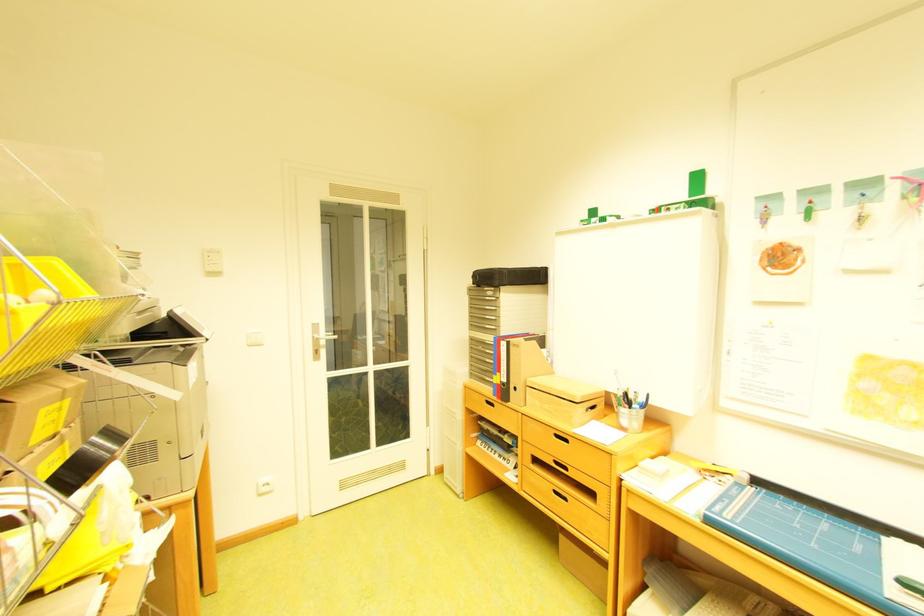
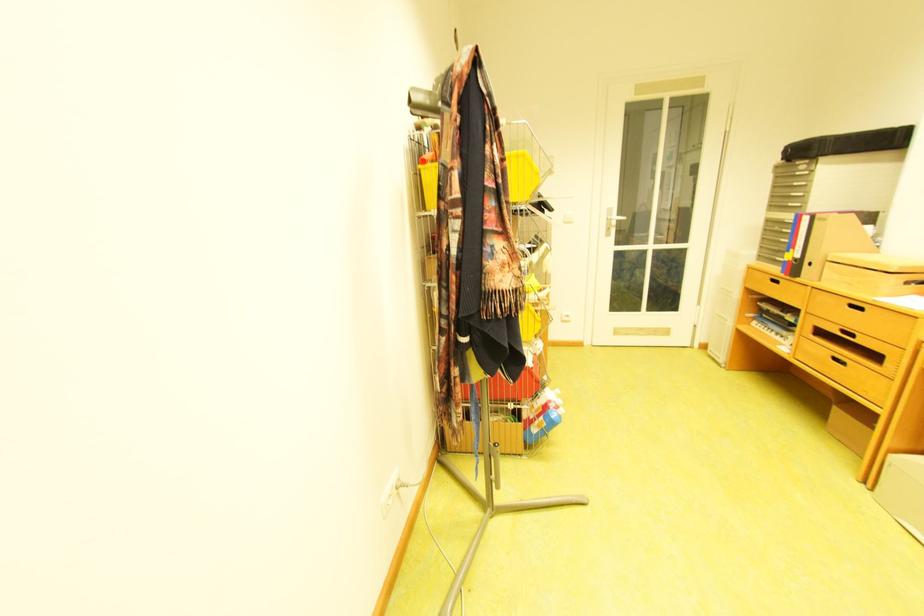
In the second image, find the point that corresponds to point 327,337 in the first image.

(621, 217)